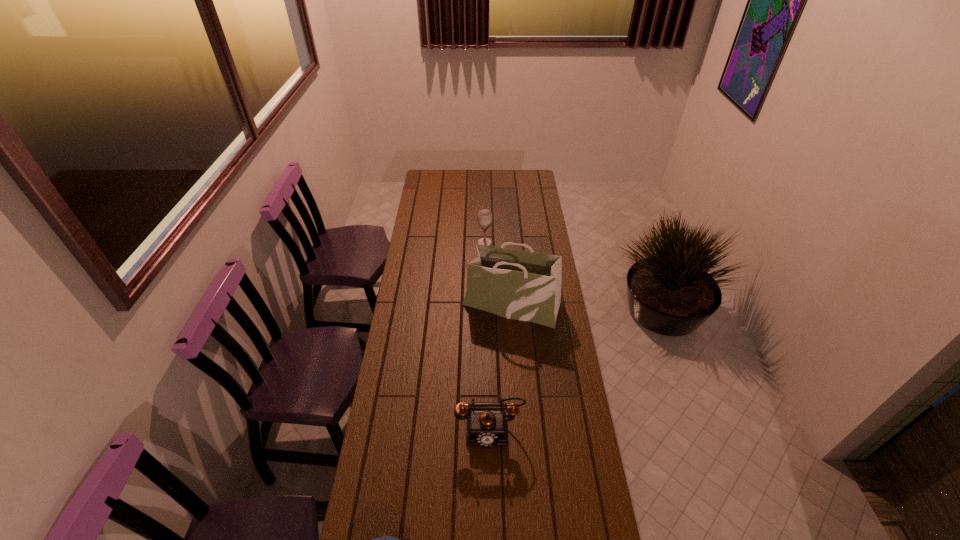
Where is `vacant space at the right edge`? vacant space at the right edge is located at coordinates (541, 206).

Locate an element on the screen. vacant area at the far right corner of the desktop is located at coordinates (523, 171).

Locate an element on the screen. This screenshot has height=540, width=960. free area in between the telephone and the wineglass is located at coordinates (487, 336).

At what (x,y) coordinates should I click in order to perform the action: click on free spot between the tallest object and the telephone. Please return your answer as a coordinate pair (x, y). The width and height of the screenshot is (960, 540). Looking at the image, I should click on (500, 366).

Where is `free area in between the grocery bag and the second nearest object`? The width and height of the screenshot is (960, 540). free area in between the grocery bag and the second nearest object is located at coordinates (500, 366).

This screenshot has width=960, height=540. Identify the location of vacant point located between the wineglass and the third farthest object. (487, 336).

Find the location of a particular element. This screenshot has width=960, height=540. free spot between the telephone and the farthest object is located at coordinates (487, 336).

Identify which object is the third closest to the shortest object. Please provide its 2D coordinates. Your answer should be formatted as a tuple, i.e. [(x, y)], where the tuple contains the x and y coordinates of a point satisfying the conditions above.

[(484, 216)]

I want to click on the second closest object to the grocery bag, so click(487, 426).